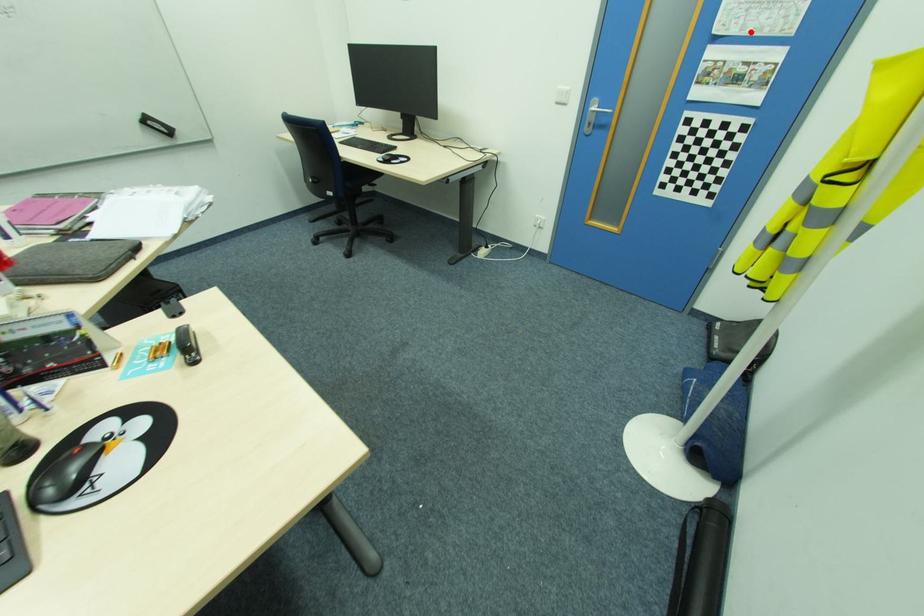
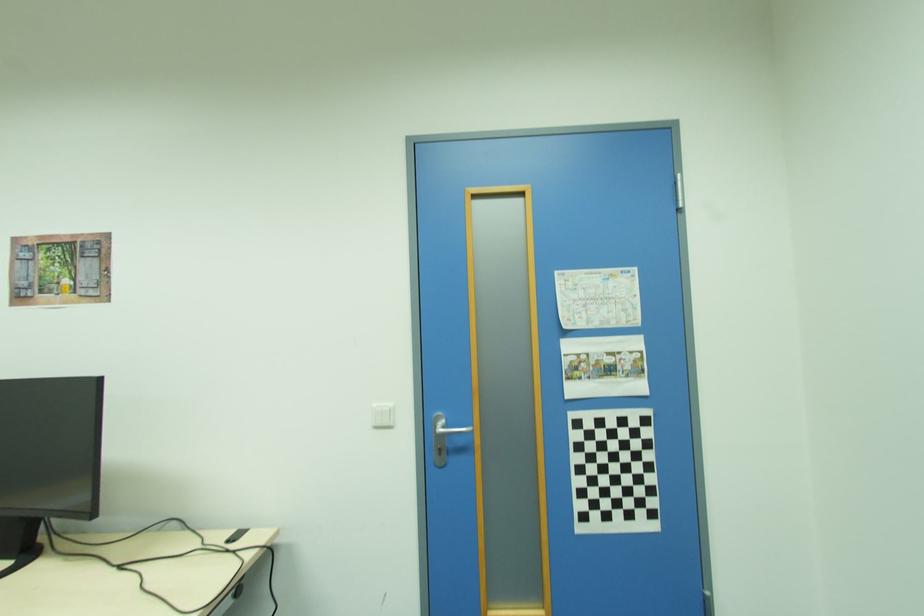
Question: I am providing you with two images of the same scene from different viewpoints. A red point is marked on the first image. Is the red point's position out of view in image 2?

Choices:
 (A) Yes
 (B) No

Answer: (B)